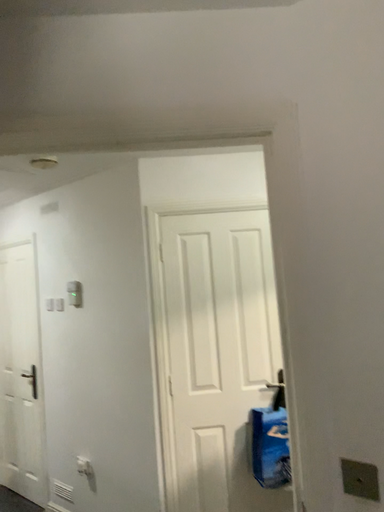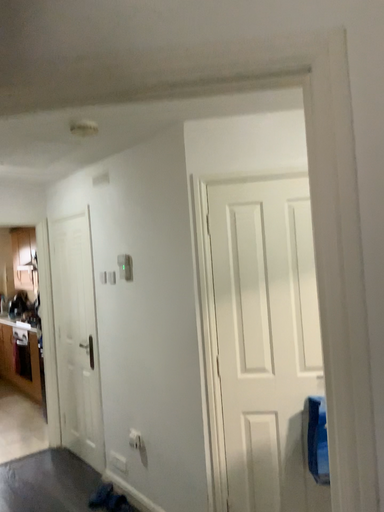
Question: Which way did the camera rotate in the video?

Choices:
 (A) rotated right
 (B) rotated left

Answer: (B)